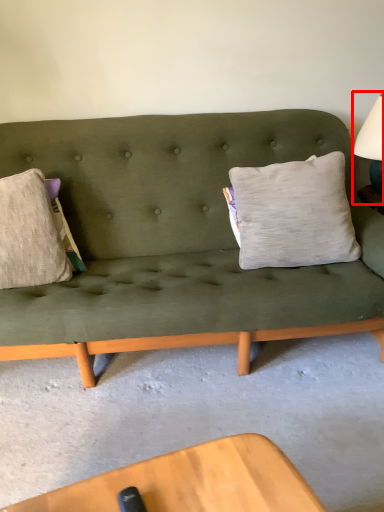
Question: From the image's perspective, what is the correct spatial positioning of table lamp (annotated by the red box) in reference to pillow?

Choices:
 (A) below
 (B) above

Answer: (B)